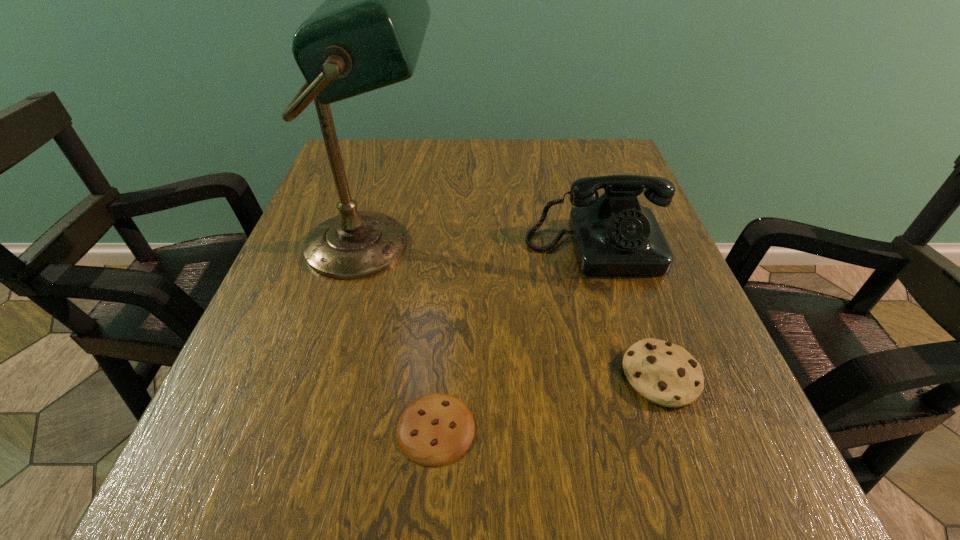
Where is `free space that satisfies the following two spatial constraints: 1. above the green lampshade of the taller cookie; 2. on the left side of the tallest object`? free space that satisfies the following two spatial constraints: 1. above the green lampshade of the taller cookie; 2. on the left side of the tallest object is located at coordinates (337, 375).

Where is `free location that satisfies the following two spatial constraints: 1. above the green lampshade of the third tallest object; 2. on the left side of the table lamp`? This screenshot has height=540, width=960. free location that satisfies the following two spatial constraints: 1. above the green lampshade of the third tallest object; 2. on the left side of the table lamp is located at coordinates (337, 375).

Where is `vacant region that satisfies the following two spatial constraints: 1. above the green lampshade of the left cookie; 2. on the right side of the tallest object`? Image resolution: width=960 pixels, height=540 pixels. vacant region that satisfies the following two spatial constraints: 1. above the green lampshade of the left cookie; 2. on the right side of the tallest object is located at coordinates (323, 428).

Identify the location of free location that satisfies the following two spatial constraints: 1. above the green lampshade of the tallest object; 2. on the left side of the shorter cookie. (323, 428).

What are the coordinates of `vacant space that satisfies the following two spatial constraints: 1. above the green lampshade of the shortest object; 2. on the left side of the table lamp` in the screenshot? It's located at click(323, 428).

Locate an element on the screen. Image resolution: width=960 pixels, height=540 pixels. blank area in the image that satisfies the following two spatial constraints: 1. on the dial of the third tallest object; 2. on the left side of the telephone is located at coordinates (634, 375).

Identify the location of vacant position in the image that satisfies the following two spatial constraints: 1. on the back side of the second shortest object; 2. on the right side of the shortest object. (440, 375).